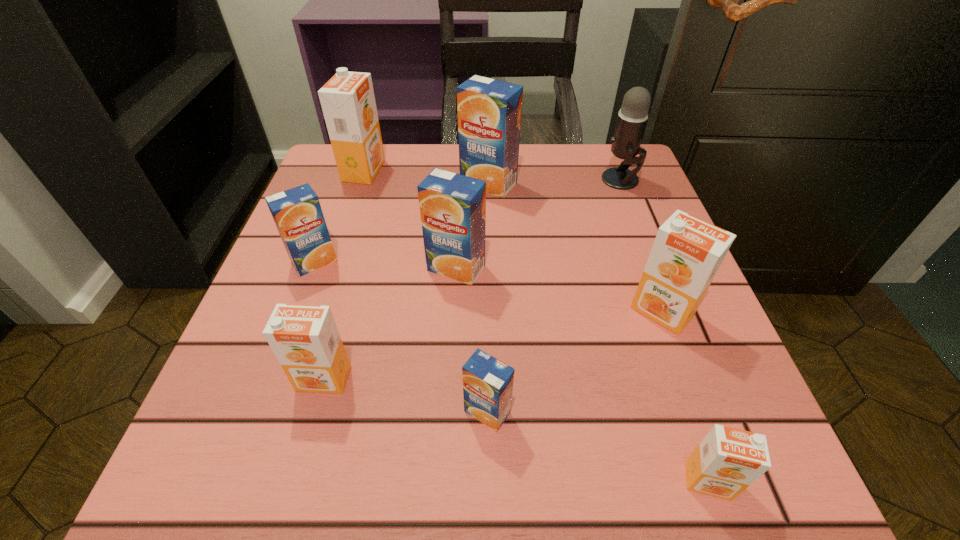
Where is `the biggest blue orange_juice`? Image resolution: width=960 pixels, height=540 pixels. the biggest blue orange_juice is located at coordinates (489, 111).

You are a GUI agent. You are given a task and a screenshot of the screen. Output one action in this format:
    pyautogui.click(x=<x>, y=<y>)
    Task: Click on the biggest orange orange juice
    The image size is (960, 540).
    Given the screenshot: What is the action you would take?
    pyautogui.click(x=347, y=100)

Locate an element on the screen. Image resolution: width=960 pixels, height=540 pixels. gray microphone is located at coordinates (632, 117).

In order to click on the second biggest blue orange_juice in this screenshot , I will do [x=452, y=206].

I want to click on the third smallest orange orange juice, so click(x=687, y=252).

Image resolution: width=960 pixels, height=540 pixels. In order to click on the third nearest orange orange juice in this screenshot , I will do (687, 252).

Find the location of a particular element. the second smallest blue orange_juice is located at coordinates (297, 213).

Identify the location of the second nearest orange orange juice. This screenshot has height=540, width=960. (304, 338).

This screenshot has height=540, width=960. I want to click on the smallest blue orange_juice, so click(x=487, y=382).

Where is `the nearest orange juice`? This screenshot has width=960, height=540. the nearest orange juice is located at coordinates (727, 461).